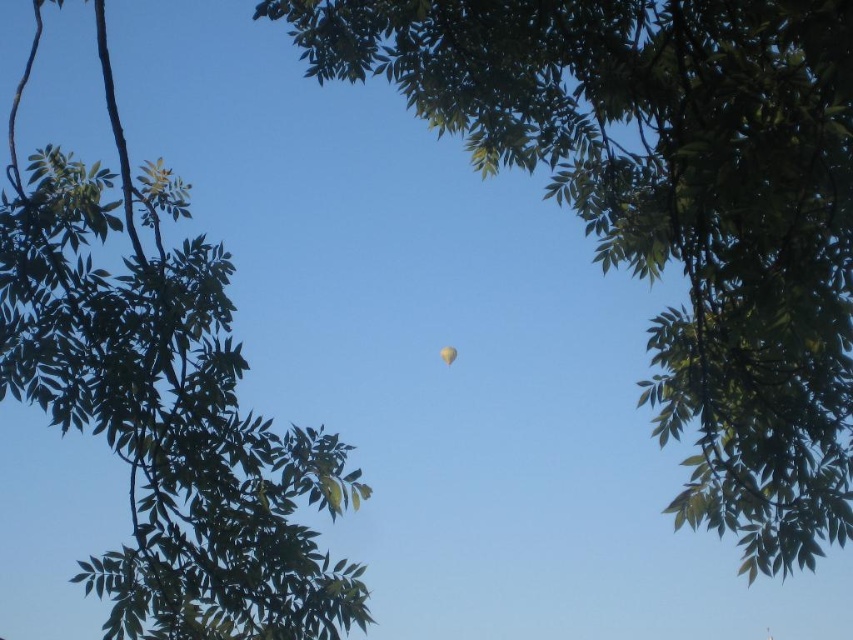
The height and width of the screenshot is (640, 853). What are the coordinates of `green leafy tree at center` in the screenshot? It's located at (672, 205).

Is green leafy tree at center closer to camera compared to translucent yellow balloon at center?

Yes, it is.

This screenshot has height=640, width=853. What are the coordinates of `green leafy tree at center` in the screenshot? It's located at (672, 205).

Between green leafy tree at upper center and translucent yellow balloon at center, which one is positioned higher?

Positioned higher is green leafy tree at upper center.

Between green leafy tree at upper center and translucent yellow balloon at center, which one is positioned lower?

translucent yellow balloon at center is lower down.

The width and height of the screenshot is (853, 640). What do you see at coordinates (165, 404) in the screenshot?
I see `green leafy tree at upper center` at bounding box center [165, 404].

I want to click on green leafy tree at upper center, so click(x=165, y=404).

From the picture: Is green leafy tree at center positioned behind green leafy tree at upper center?

No, green leafy tree at center is in front of green leafy tree at upper center.

Is green leafy tree at center above green leafy tree at upper center?

Yes.

Locate an element on the screen. green leafy tree at center is located at coordinates (672, 205).